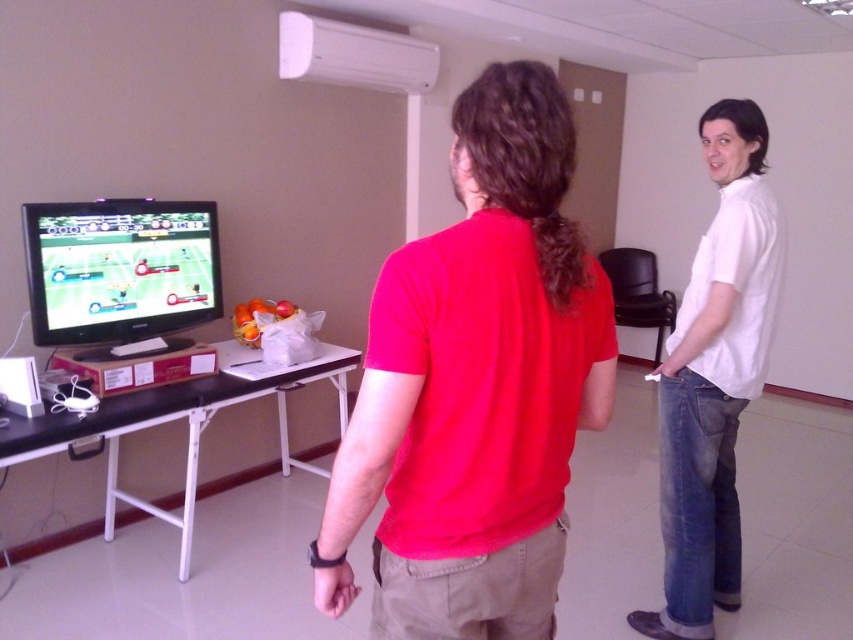
Which is behind, point (705, 637) or point (204, 204)?

The point (204, 204) is more distant.

In the scene shown: Between white cotton shirt at right and matte black television at left, which one appears on the left side from the viewer's perspective?

matte black television at left

Who is more distant from viewer, (733, 230) or (102, 264)?

The point (102, 264) is more distant.

Image resolution: width=853 pixels, height=640 pixels. I want to click on white cotton shirt at right, so click(x=714, y=378).

Is point (483, 582) closer to camera compared to point (682, 452)?

Yes, point (483, 582) is in front of point (682, 452).

Is red matte shirt at center further to the viewer compared to white cotton shirt at right?

→ That is False.

This screenshot has width=853, height=640. What do you see at coordinates (476, 387) in the screenshot?
I see `red matte shirt at center` at bounding box center [476, 387].

The image size is (853, 640). Identify the location of red matte shirt at center. (476, 387).

Is red matte shirt at center bigger than matte black television at left?

Yes, red matte shirt at center is bigger than matte black television at left.

Is red matte shirt at center taller than matte black television at left?

Correct, red matte shirt at center is much taller as matte black television at left.

Between point (541, 454) and point (45, 262), which one is positioned behind?

Point (45, 262)

Find the location of a particular element. red matte shirt at center is located at coordinates (476, 387).